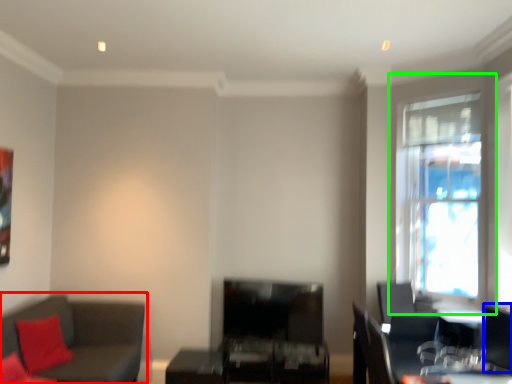
Question: Estimate the real-world distances between objects in this image. Which object is closer to studio couch (highlighted by a red box), swivel chair (highlighted by a blue box) or window (highlighted by a green box)?

Choices:
 (A) swivel chair
 (B) window

Answer: (A)